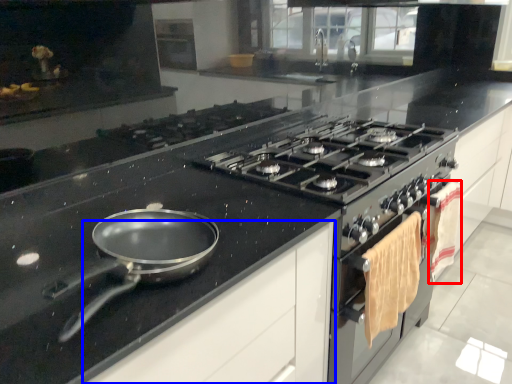
Question: Which object is closer to the camera taking this photo, material (highlighted by a red box) or cabinetry (highlighted by a blue box)?

Choices:
 (A) material
 (B) cabinetry

Answer: (B)